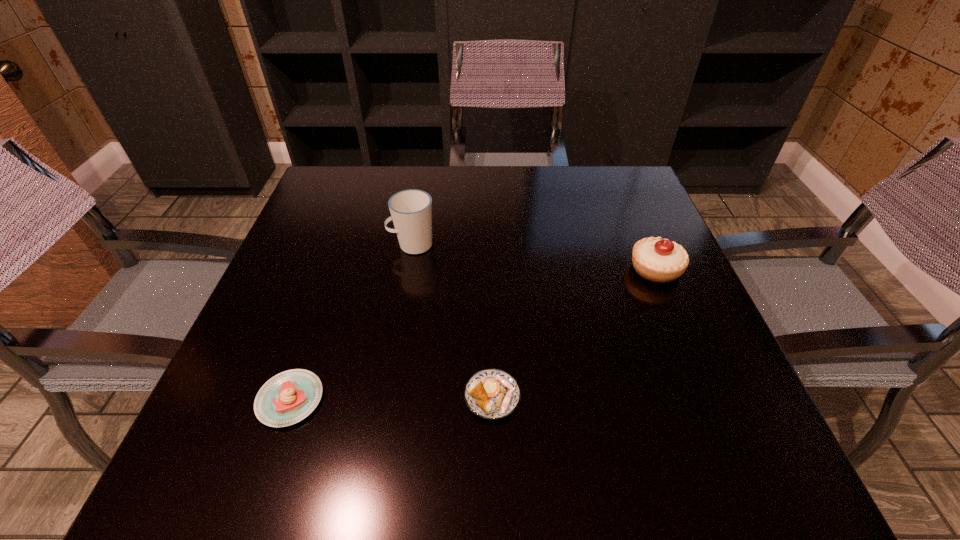
Identify the location of the tallest object. (411, 210).

Locate an element on the screen. This screenshot has width=960, height=540. the second object from left to right is located at coordinates (411, 210).

Image resolution: width=960 pixels, height=540 pixels. Find the location of `the tallest pastry`. the tallest pastry is located at coordinates (660, 260).

Locate an element on the screen. This screenshot has width=960, height=540. the rightmost pastry is located at coordinates (660, 260).

The image size is (960, 540). I want to click on the second object from right to left, so click(492, 393).

Identify the location of the leftmost pastry. Image resolution: width=960 pixels, height=540 pixels. (287, 398).

Where is `free space located with a handle on the side of the cup`? free space located with a handle on the side of the cup is located at coordinates (330, 245).

Find the location of `free location located with a handle on the side of the cup`. free location located with a handle on the side of the cup is located at coordinates (322, 245).

What are the coordinates of `vacant region located 0.180m with a handle on the side of the cup` in the screenshot? It's located at (313, 245).

Locate an element on the screen. The image size is (960, 540). vacant space located 0.150m on the left of the rightmost object is located at coordinates (563, 269).